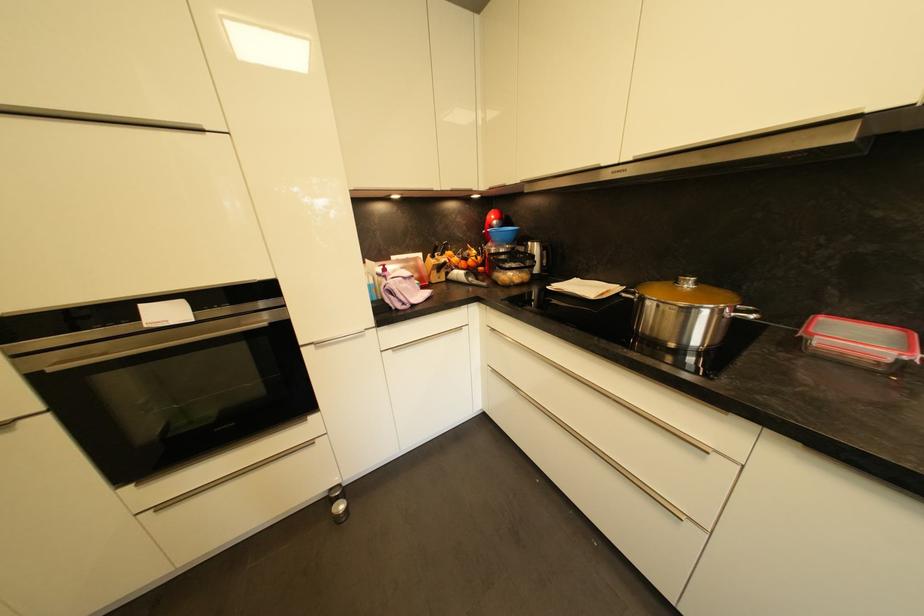
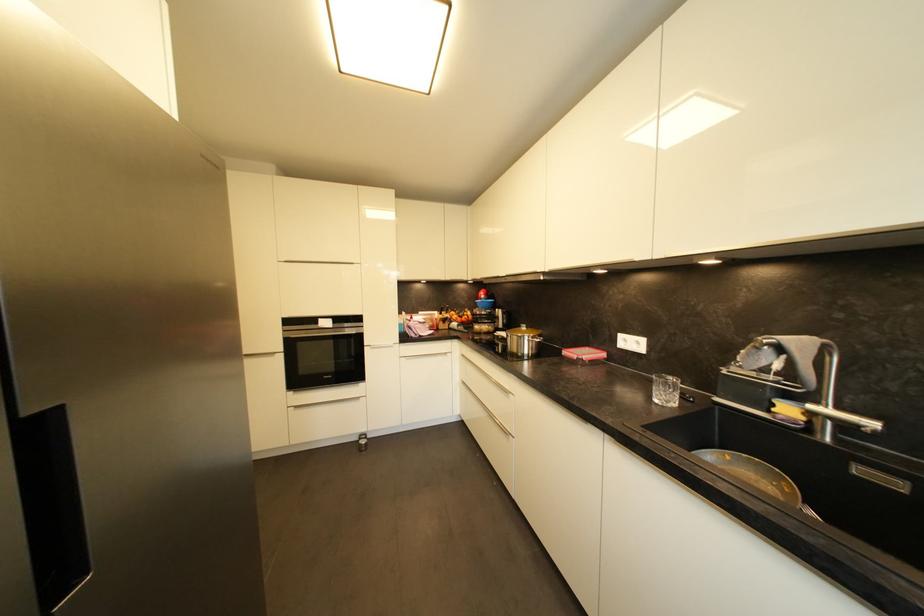
Where in the second image is the point corresponding to (860,320) from the first image?

(602, 350)